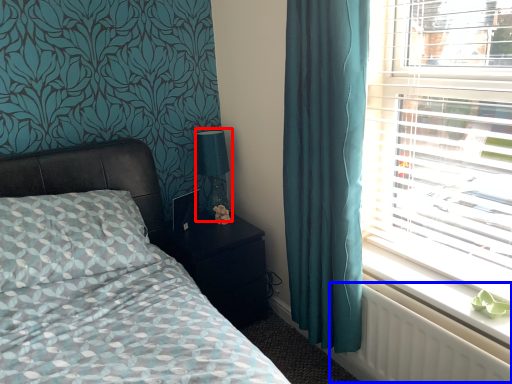
Question: Which object appears closest to the camera in this image, table lamp (highlighted by a red box) or radiator (highlighted by a blue box)?

Choices:
 (A) table lamp
 (B) radiator

Answer: (B)